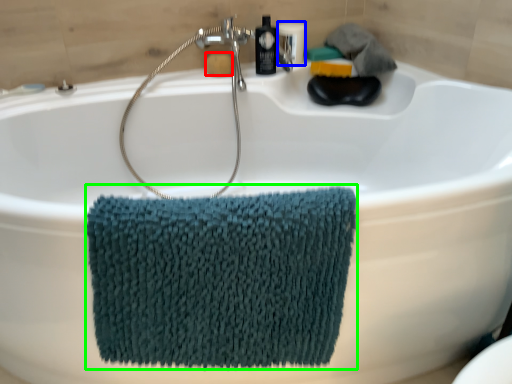
Question: Estimate the real-world distances between objects in this image. Which object is farther from soap (highlighted by a red box), toiletry (highlighted by a blue box) or bath towel (highlighted by a green box)?

Choices:
 (A) toiletry
 (B) bath towel

Answer: (B)